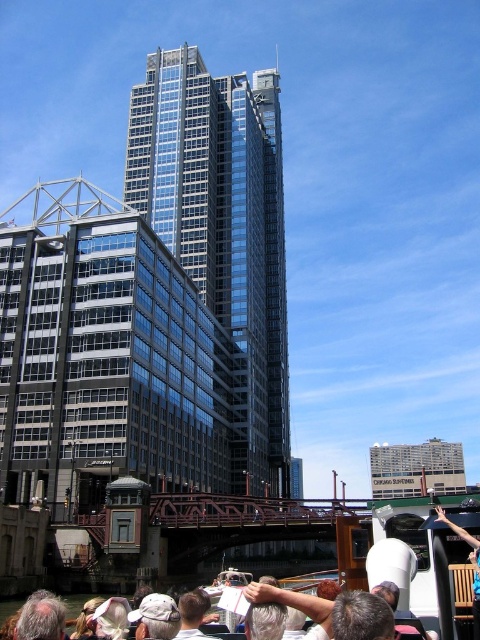
Consider the image. Can you confirm if gray hair at lower left is positioned to the right of white fabric cap at lower center?

No, gray hair at lower left is not to the right of white fabric cap at lower center.

Who is positioned more to the right, gray hair at lower left or white fabric cap at lower center?

Positioned to the right is white fabric cap at lower center.

Locate an element on the screen. This screenshot has height=640, width=480. gray hair at lower left is located at coordinates (40, 618).

Which is above, glassy steel skyscraper at center or white fabric cap at lower center?

glassy steel skyscraper at center is higher up.

Does glassy steel skyscraper at center come behind white fabric cap at lower center?

Yes, it is.

The width and height of the screenshot is (480, 640). What do you see at coordinates (223, 232) in the screenshot?
I see `glassy steel skyscraper at center` at bounding box center [223, 232].

The height and width of the screenshot is (640, 480). I want to click on glassy steel skyscraper at center, so click(x=223, y=232).

Describe the element at coordinates (223, 232) in the screenshot. This screenshot has height=640, width=480. I see `glassy steel skyscraper at center` at that location.

Find the location of a particular element. The height and width of the screenshot is (640, 480). glassy steel skyscraper at center is located at coordinates (223, 232).

At what (x,y) coordinates should I click in order to perform the action: click on glassy steel skyscraper at center. Please return your answer as a coordinate pair (x, y). Looking at the image, I should click on (223, 232).

Image resolution: width=480 pixels, height=640 pixels. Identify the location of glassy steel skyscraper at center. (223, 232).